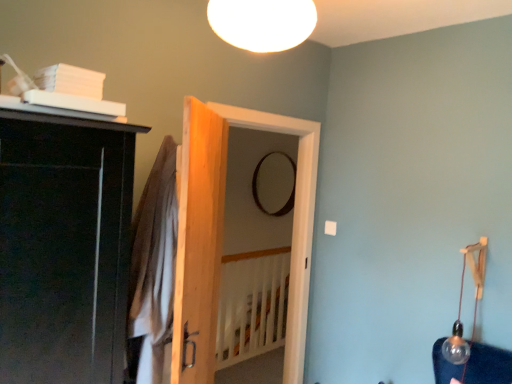
Question: Does white wooden bed frame at center have a lesser height compared to clear glass bulb at right, which is the 2th lamp from left to right?

Choices:
 (A) no
 (B) yes

Answer: (A)

Question: From a real-world perspective, is white wooden bed frame at center beneath clear glass bulb at right, the second lamp viewed from the front?

Choices:
 (A) yes
 (B) no

Answer: (A)

Question: Is white wooden bed frame at center bigger than clear glass bulb at right, arranged as the first lamp when viewed from the right?

Choices:
 (A) no
 (B) yes

Answer: (B)

Question: Is the depth of white wooden bed frame at center greater than that of clear glass bulb at right, acting as the first lamp starting from the back?

Choices:
 (A) no
 (B) yes

Answer: (B)

Question: Does white wooden bed frame at center have a greater height compared to clear glass bulb at right, acting as the first lamp starting from the back?

Choices:
 (A) no
 (B) yes

Answer: (B)

Question: Looking at their shapes, would you say wooden door at center, which appears as the second door when viewed from the front, is wider or thinner than natural wood door at center, placed as the 1th door when sorted from front to back?

Choices:
 (A) wide
 (B) thin

Answer: (A)

Question: Considering the positions of wooden door at center, positioned as the first door in back-to-front order, and natural wood door at center, placed as the 1th door when sorted from front to back, in the image, is wooden door at center, positioned as the first door in back-to-front order, taller or shorter than natural wood door at center, placed as the 1th door when sorted from front to back,?

Choices:
 (A) tall
 (B) short

Answer: (A)

Question: Is wooden door at center, which appears as the second door when viewed from the front, inside the boundaries of natural wood door at center, placed as the 1th door when sorted from front to back, or outside?

Choices:
 (A) outside
 (B) inside

Answer: (A)

Question: From a real-world perspective, relative to natural wood door at center, placed as the 1th door when sorted from front to back, is wooden door at center, positioned as the first door in back-to-front order, vertically above or below?

Choices:
 (A) above
 (B) below

Answer: (B)

Question: Is white matte ceiling light at upper center, the second lamp viewed from the back, in front of or behind brown cotton robe at center in the image?

Choices:
 (A) behind
 (B) front

Answer: (B)

Question: From the image's perspective, is white matte ceiling light at upper center, which ranks as the 1th lamp in left-to-right order, located above or below brown cotton robe at center?

Choices:
 (A) below
 (B) above

Answer: (B)

Question: Is white matte ceiling light at upper center, acting as the first lamp starting from the front, inside the boundaries of brown cotton robe at center, or outside?

Choices:
 (A) outside
 (B) inside

Answer: (A)

Question: Would you say white matte ceiling light at upper center, the first lamp viewed from the top, is to the left or to the right of brown cotton robe at center in the picture?

Choices:
 (A) right
 (B) left

Answer: (A)

Question: From a real-world perspective, is clear glass bulb at right, the second lamp viewed from the front, physically located above or below brown cotton robe at center?

Choices:
 (A) above
 (B) below

Answer: (B)

Question: From the image's perspective, is clear glass bulb at right, which is the 2th lamp from left to right, located above or below brown cotton robe at center?

Choices:
 (A) below
 (B) above

Answer: (A)